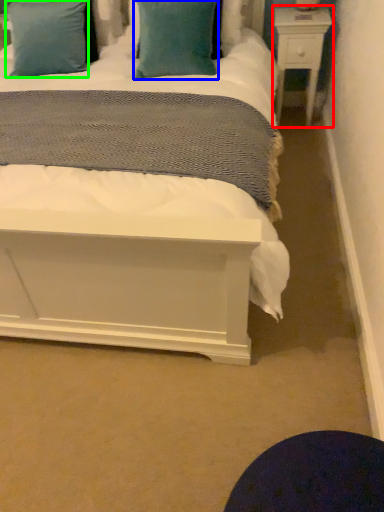
Question: Based on their relative distances, which object is nearer to nightstand (highlighted by a red box)? Choose from pillow (highlighted by a blue box) and pillow (highlighted by a green box).

Choices:
 (A) pillow
 (B) pillow

Answer: (A)